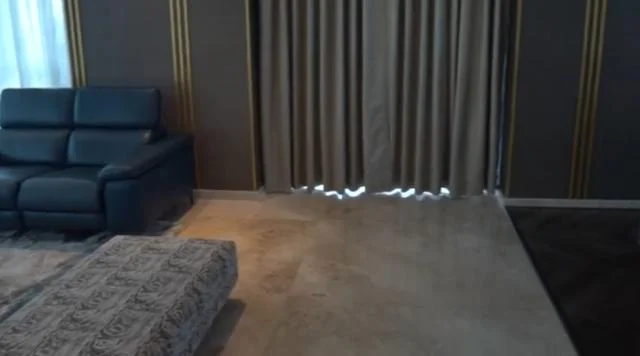
Locate an element on the screen. The image size is (640, 356). right of ottoman is located at coordinates (316, 319).